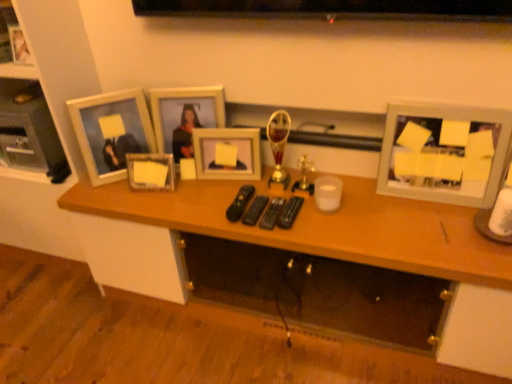
Identify the location of blank space above wooden desk at center (from a real-world perspective). The image size is (512, 384). (290, 192).